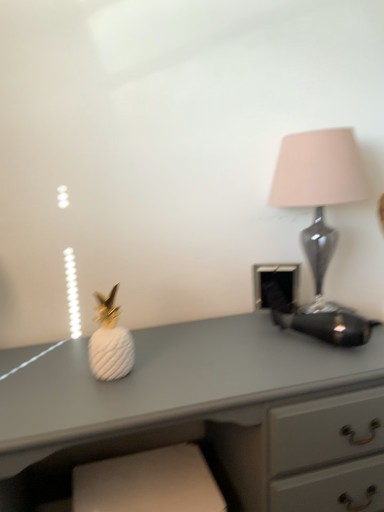
Describe the element at coordinates (206, 412) in the screenshot. I see `white matte pineapple at left` at that location.

Where is `white matte pineapple at center`? white matte pineapple at center is located at coordinates (110, 341).

Identify the location of white matte pineapple at left. The height and width of the screenshot is (512, 384). (206, 412).

Does white matte pineapple at left come behind white matte pineapple at center?

No, the depth of white matte pineapple at left is less than that of white matte pineapple at center.

From a real-world perspective, is white matte pineapple at left physically below white matte pineapple at center?

Correct, in the physical world, white matte pineapple at left is lower than white matte pineapple at center.

Looking at this image, does white matte pineapple at left have a greater height compared to white matte pineapple at center?

Yes, white matte pineapple at left is taller than white matte pineapple at center.

Can you see white matte pineapple at center touching matte glass lamp at right?

No, white matte pineapple at center is not with matte glass lamp at right.

Does white matte pineapple at center have a greater width compared to matte glass lamp at right?

Incorrect, the width of white matte pineapple at center does not surpass that of matte glass lamp at right.

Does point (89, 351) appear closer or farther from the camera than point (306, 190)?

Point (89, 351) is closer to the camera than point (306, 190).

Considering the positions of points (334, 180) and (108, 378), is point (334, 180) closer to camera compared to point (108, 378)?

That is False.

Looking at this image, does matte glass lamp at right have a greater width compared to white matte pineapple at center?

Indeed, matte glass lamp at right has a greater width compared to white matte pineapple at center.

Consider the image. Between matte glass lamp at right and white matte pineapple at center, which one has larger size?

Bigger between the two is matte glass lamp at right.

From a real-world perspective, between matte glass lamp at right and white matte pineapple at center, who is vertically higher?

matte glass lamp at right is physically above.

Considering the relative positions of white matte pineapple at left and matte glass lamp at right in the image provided, is white matte pineapple at left to the left or to the right of matte glass lamp at right?

From the image, it's evident that white matte pineapple at left is to the left of matte glass lamp at right.

Based on the photo, is white matte pineapple at left looking in the opposite direction of matte glass lamp at right?

That's not correct — white matte pineapple at left is not looking away from matte glass lamp at right.

Between white matte pineapple at left and matte glass lamp at right, which one has larger size?

white matte pineapple at left.

Consider the image. From a real-world perspective, which object stands above the other?

matte glass lamp at right, from a real-world perspective.

Image resolution: width=384 pixels, height=512 pixels. I want to click on lamp above the white matte pineapple at left (from a real-world perspective), so click(x=319, y=186).

Who is shorter, matte glass lamp at right or white matte pineapple at left?

With less height is matte glass lamp at right.

Is matte glass lamp at right next to white matte pineapple at left?

No.

Can you confirm if matte glass lamp at right is thinner than white matte pineapple at left?

Correct, the width of matte glass lamp at right is less than that of white matte pineapple at left.

Between white matte pineapple at center and white matte pineapple at left, which one has less height?

white matte pineapple at center.

Is white matte pineapple at center to the right of white matte pineapple at left from the viewer's perspective?

No, white matte pineapple at center is not to the right of white matte pineapple at left.

Is white matte pineapple at center wider than white matte pineapple at left?

Incorrect, the width of white matte pineapple at center does not surpass that of white matte pineapple at left.

Which object is further away from the camera taking this photo, white matte pineapple at center or white matte pineapple at left?

white matte pineapple at center is further from the camera.

Where is `desk that is in front of the white matte pineapple at center`? The image size is (384, 512). desk that is in front of the white matte pineapple at center is located at coordinates (206, 412).

Locate an element on the screen. The height and width of the screenshot is (512, 384). lamp above the white matte pineapple at center (from the image's perspective) is located at coordinates (319, 186).

From the picture: Which object lies further to the anchor point matte glass lamp at right, white matte pineapple at left or white matte pineapple at center?

white matte pineapple at center.

Based on their spatial positions, is white matte pineapple at center or matte glass lamp at right closer to white matte pineapple at left?

The object closer to white matte pineapple at left is white matte pineapple at center.

Based on their spatial positions, is white matte pineapple at center or white matte pineapple at left further from matte glass lamp at right?

white matte pineapple at center is positioned further to the anchor matte glass lamp at right.

Estimate the real-world distances between objects in this image. Which object is closer to white matte pineapple at center, white matte pineapple at left or matte glass lamp at right?

The object closer to white matte pineapple at center is white matte pineapple at left.

Considering their positions, is matte glass lamp at right positioned further to white matte pineapple at left than white matte pineapple at center?

Based on the image, matte glass lamp at right appears to be further to white matte pineapple at left.

Looking at the image, which one is located closer to white matte pineapple at center, matte glass lamp at right or white matte pineapple at left?

white matte pineapple at left is closer to white matte pineapple at center.

The height and width of the screenshot is (512, 384). In order to click on miniature between matte glass lamp at right and white matte pineapple at left from top to bottom in this screenshot , I will do `click(110, 341)`.